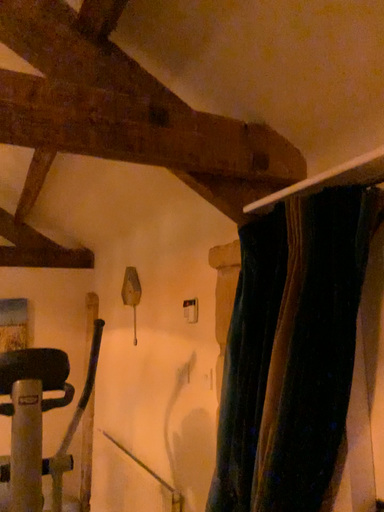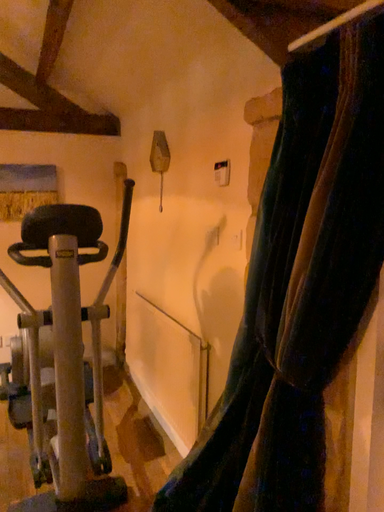
Question: Which way did the camera rotate in the video?

Choices:
 (A) rotated downward
 (B) rotated upward

Answer: (A)